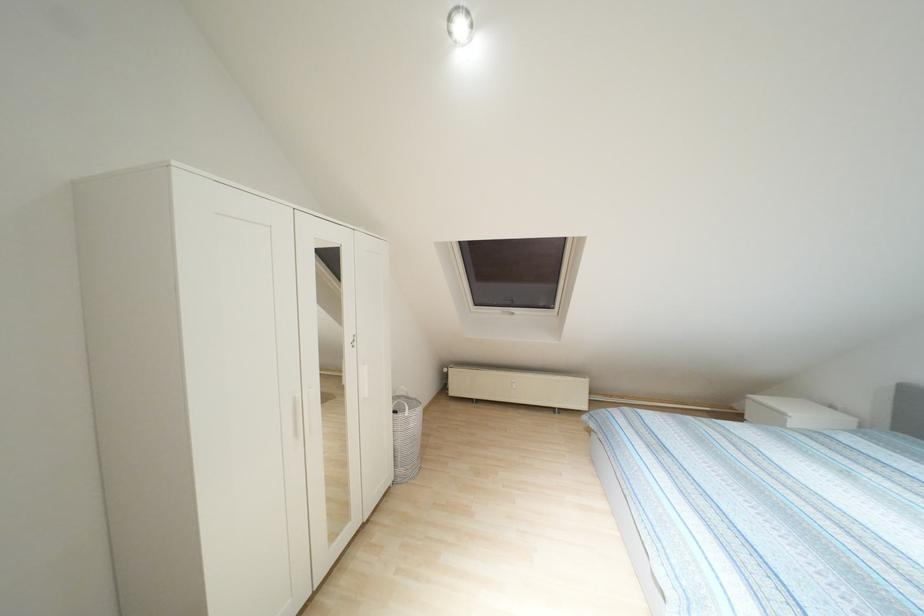
Describe the element at coordinates (512, 383) in the screenshot. I see `a radiator valve` at that location.